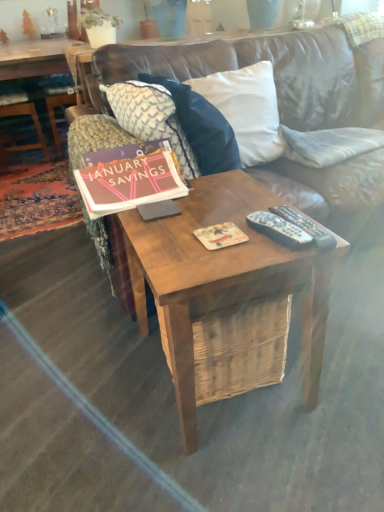
Where is `free space between black plastic remote controls at center, which ranks as the second remote control in right-to-left order, and matte cardboard magazine at center`? The width and height of the screenshot is (384, 512). free space between black plastic remote controls at center, which ranks as the second remote control in right-to-left order, and matte cardboard magazine at center is located at coordinates (259, 248).